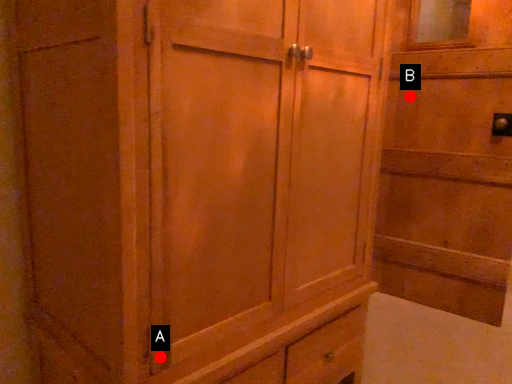
Question: Two points are circled on the image, labeled by A and B beside each circle. Which point is farther from the camera taking this photo?

Choices:
 (A) A is further
 (B) B is further

Answer: (B)